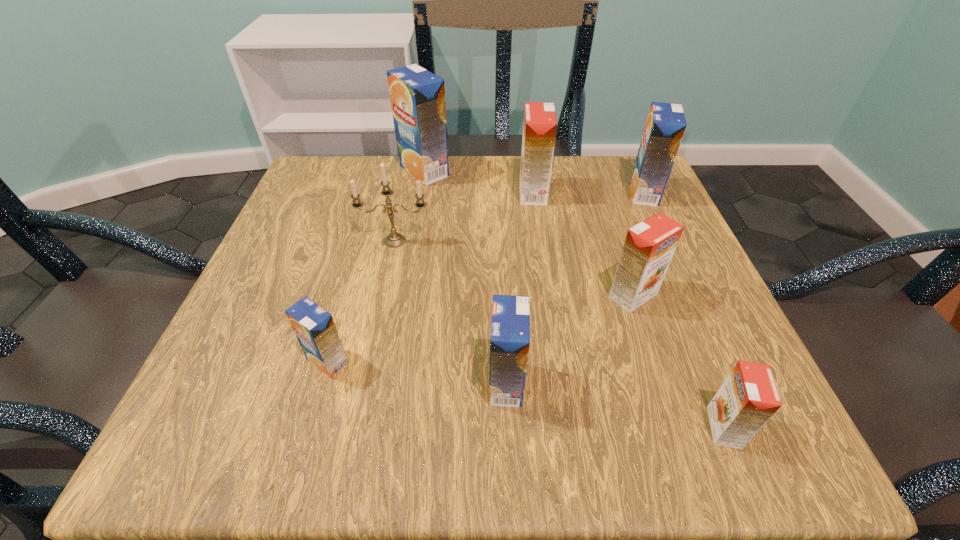
Locate an element on the screen. This screenshot has width=960, height=540. the second smallest blue orange_juice is located at coordinates (510, 328).

Locate an element on the screen. This screenshot has height=540, width=960. the smallest blue orange_juice is located at coordinates (314, 327).

This screenshot has height=540, width=960. What are the coordinates of `the leftmost orange juice` in the screenshot? It's located at (314, 327).

You are a GUI agent. You are given a task and a screenshot of the screen. Output one action in this format:
    pyautogui.click(x=<x>, y=<y>)
    Task: Click on the nearest orange orange juice
    The image size is (960, 540).
    Given the screenshot: What is the action you would take?
    pyautogui.click(x=748, y=398)

At what (x,y) coordinates should I click in order to perform the action: click on free location located 0.210m on the right of the third blue orange_juice from right to left. Please return your answer as a coordinate pair (x, y). The height and width of the screenshot is (540, 960). Looking at the image, I should click on (541, 171).

Find the location of a particular element. free region located on the left of the fifth object from left to right is located at coordinates (356, 193).

Where is `vacant point located 0.110m on the front of the third smallest blue orange_juice`? Image resolution: width=960 pixels, height=540 pixels. vacant point located 0.110m on the front of the third smallest blue orange_juice is located at coordinates (666, 241).

Find the location of `vacant point located 0.370m on the front of the fifth nearest object`. vacant point located 0.370m on the front of the fifth nearest object is located at coordinates (354, 439).

Identify the location of free spot located 0.130m on the left of the fourth nearest object. (531, 295).

The height and width of the screenshot is (540, 960). What are the coordinates of `vacant space located 0.050m on the back of the fifth object from right to left` in the screenshot? It's located at (504, 334).